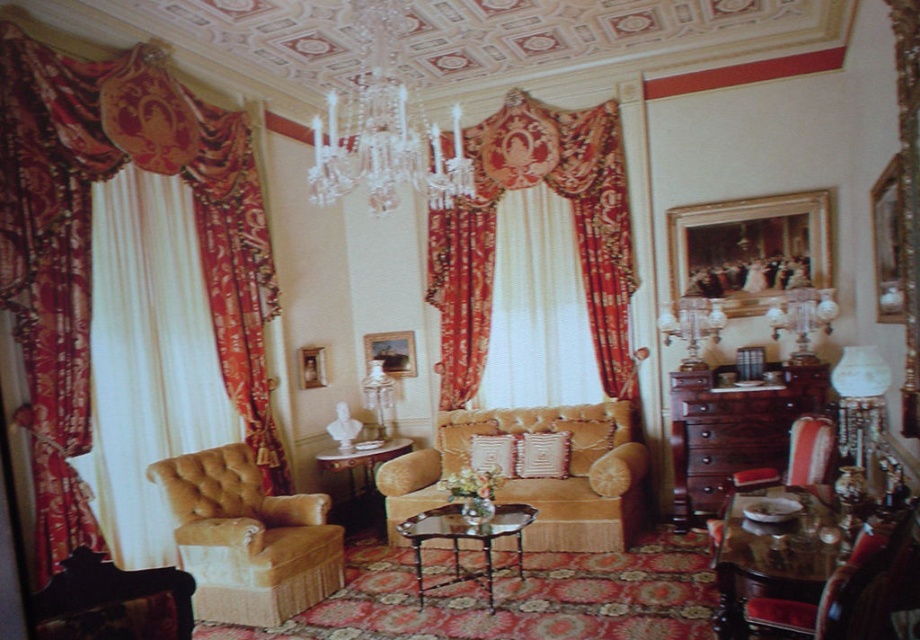
Image resolution: width=920 pixels, height=640 pixels. Describe the element at coordinates (538, 477) in the screenshot. I see `velvet gold couch at center` at that location.

Does velvet gold couch at center have a greater width compared to glass/marble coffee table at center?

Correct, the width of velvet gold couch at center exceeds that of glass/marble coffee table at center.

This screenshot has width=920, height=640. In order to click on velvet gold couch at center in this screenshot , I will do `click(538, 477)`.

Is tufted velvet armchair at left bigger than velvet red armchair at lower right?

Yes, tufted velvet armchair at left is bigger than velvet red armchair at lower right.

Describe the element at coordinates (247, 538) in the screenshot. I see `tufted velvet armchair at left` at that location.

Who is more forward, (x=289, y=508) or (x=831, y=422)?

Positioned in front is point (x=831, y=422).

This screenshot has height=640, width=920. In order to click on tufted velvet armchair at left in this screenshot , I will do `click(247, 538)`.

Which is above, tufted velvet armchair at left or velvet gold armchair at lower right?

Positioned higher is velvet gold armchair at lower right.

Can you confirm if tufted velvet armchair at left is shorter than velvet gold armchair at lower right?

In fact, tufted velvet armchair at left may be taller than velvet gold armchair at lower right.

Which is behind, point (292, 586) or point (853, 564)?

Positioned behind is point (292, 586).

The width and height of the screenshot is (920, 640). Identify the location of tufted velvet armchair at left. (247, 538).